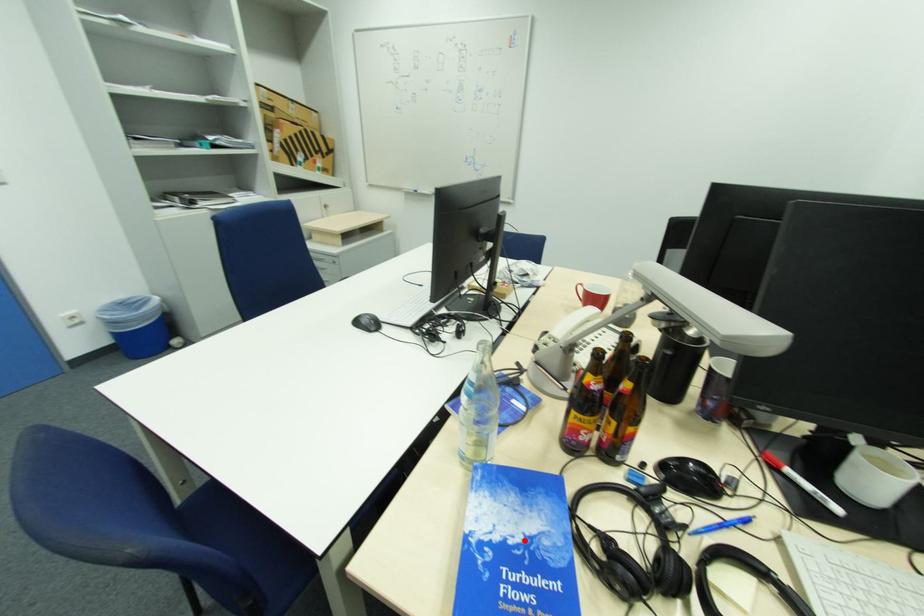
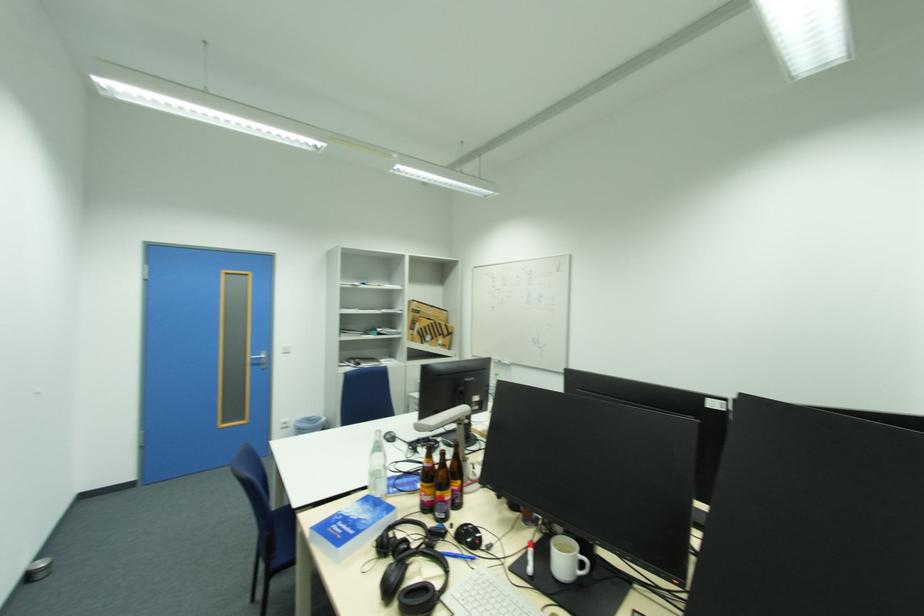
Locate, in the second image, the point that corresponds to the highlighted location in the first image.

(360, 517)